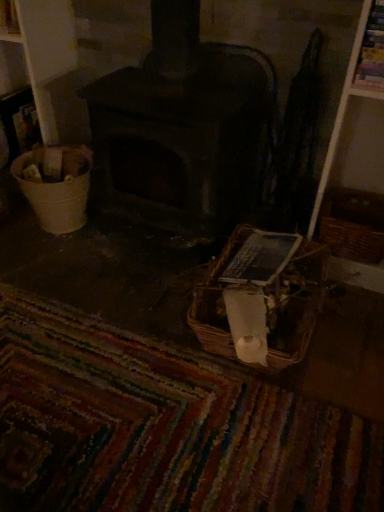
The width and height of the screenshot is (384, 512). Find the location of `vacant space situated above multicolored woven mat at lower center (from a real-world perspective)`. vacant space situated above multicolored woven mat at lower center (from a real-world perspective) is located at coordinates (139, 411).